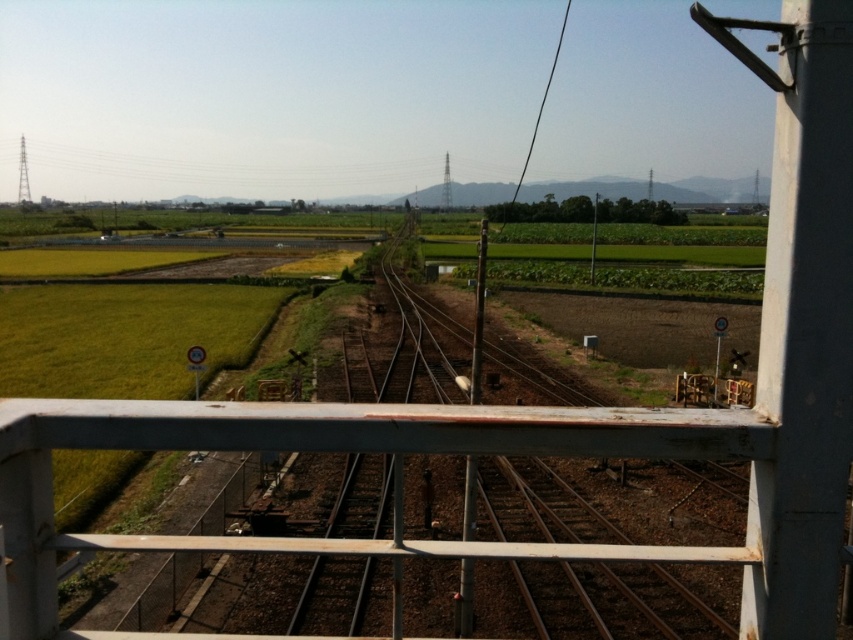
You are standing on the bridge and see the metallic pole at center and the black wire at upper center. Which object is closer to the left side of the scene?

The metallic pole at center is to the left of the black wire at upper center, so the metallic pole at center is closer to the left side of the scene.